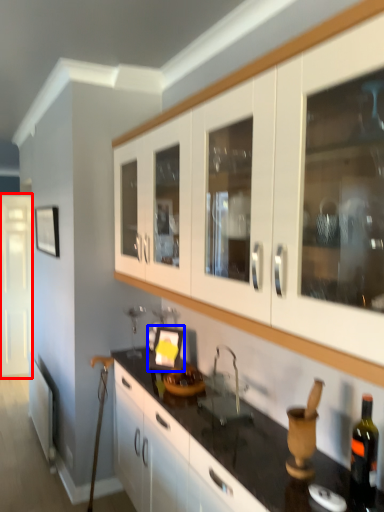
Question: Which object appears farthest to the camera in this image, glass door (highlighted by a red box) or picture frame (highlighted by a blue box)?

Choices:
 (A) glass door
 (B) picture frame

Answer: (A)